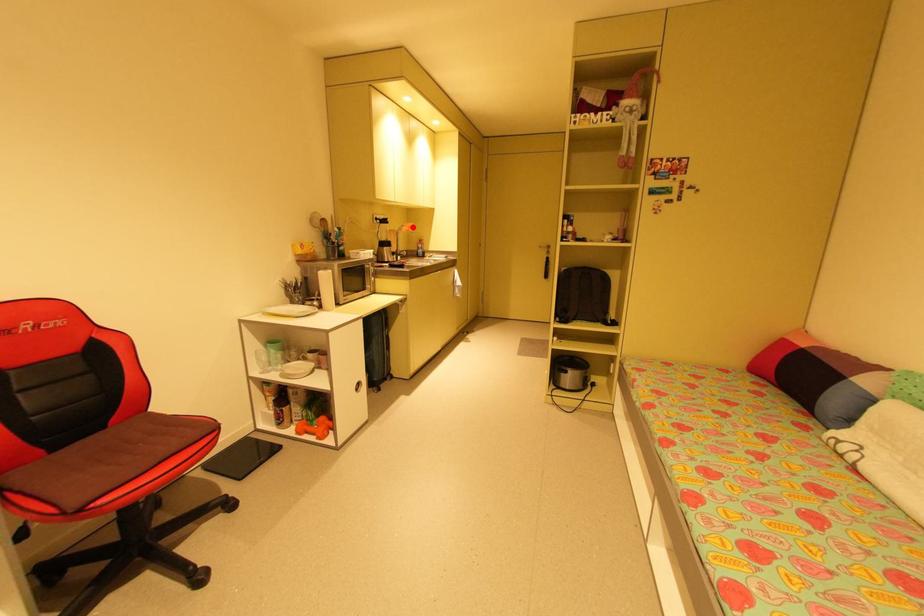
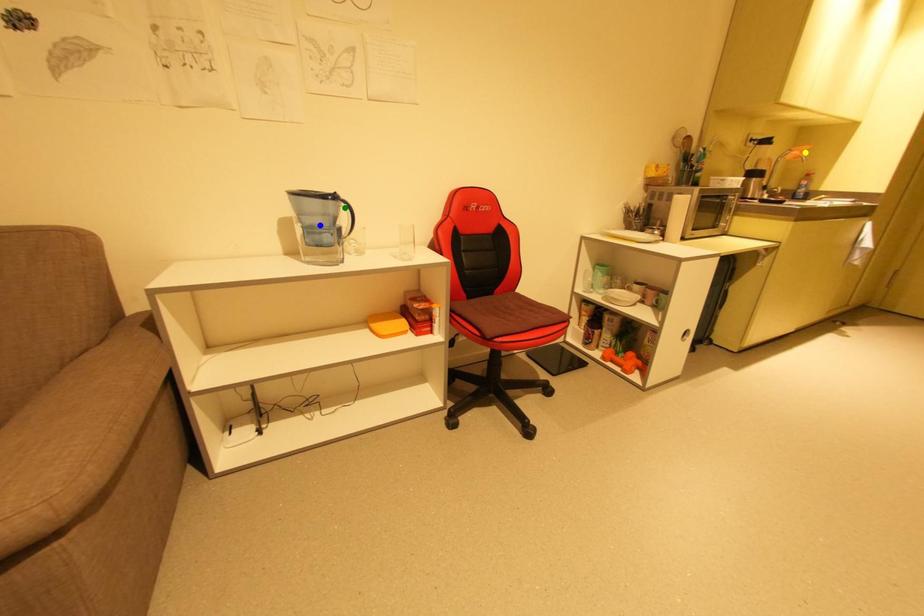
Question: I am providing you with two images of the same scene from different viewpoints. A red point is marked on the first image. You are given multiple points on the second image. In image 2, which mark is for the same physical point as the one in image 1?

Choices:
 (A) yellow point
 (B) blue point
 (C) green point

Answer: (A)